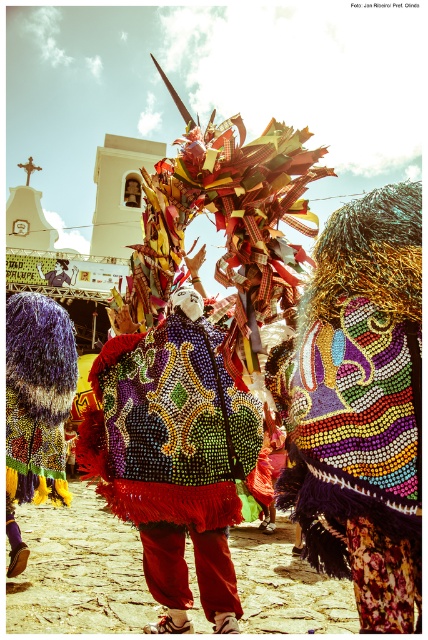
You are a photographer standing at the camera position. You want to capture a closeup shot of the shiny sequined vest at center. Considering the vest is 88.95 feet away, what is the minimum focal length lens you need to use to fill the frame with the vest? Assume the vest is 2 feet tall and your camera sensor is 1 inch in height.

The minimum focal length lens required is calculated by the formula focal length equals sensor height multiplied by distance divided by subject height. Plugging in the numbers, 1 inch multiplied by 88.95 feet divided by 2 feet equals approximately 44.475 inches. Converting inches to millimeters, 44.475 inches is about 1130 millimeters. Therefore, you need a lens with a focal length of at least 1130mm to fill the frame with the shiny sequined vest at center.

You are a photographer trying to capture the central figure in the parade. You notice the shiny sequined vest at center and the shiny sequined mask at center. Which object should you focus on to ensure it appears larger in your photo?

The shiny sequined vest at center has a greater height compared to the shiny sequined mask at center, so focusing on it will make it appear larger in the photo.